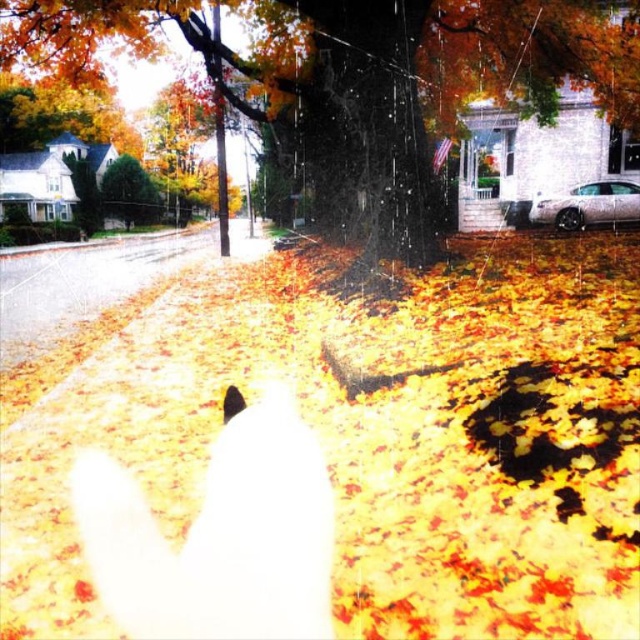
Question: Is smooth bark tree at center below green textured bush at upper left?

Choices:
 (A) yes
 (B) no

Answer: (A)

Question: Among these objects, which one is farthest from the camera?

Choices:
 (A) green textured bush at upper left
 (B) smooth bark tree at center

Answer: (A)

Question: Which point is closer to the camera?

Choices:
 (A) smooth bark tree at center
 (B) green textured bush at upper left

Answer: (A)

Question: From the image, what is the correct spatial relationship of smooth bark tree at center in relation to green textured bush at upper left?

Choices:
 (A) above
 (B) below

Answer: (B)

Question: Is smooth bark tree at center smaller than green textured bush at upper left?

Choices:
 (A) no
 (B) yes

Answer: (A)